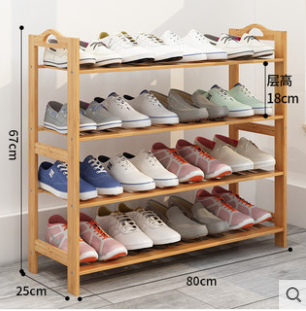
I want to click on shoes on the second highest shelf, so click(x=83, y=124), click(x=107, y=119), click(x=129, y=115), click(x=155, y=112), click(x=183, y=112), click(x=212, y=108), click(x=229, y=106), click(x=247, y=103).